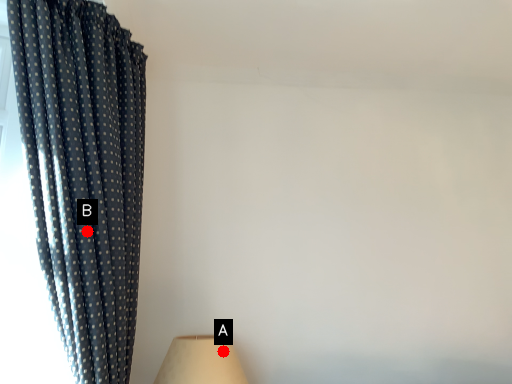
Question: Two points are circled on the image, labeled by A and B beside each circle. Which point is closer to the camera?

Choices:
 (A) A is closer
 (B) B is closer

Answer: (B)